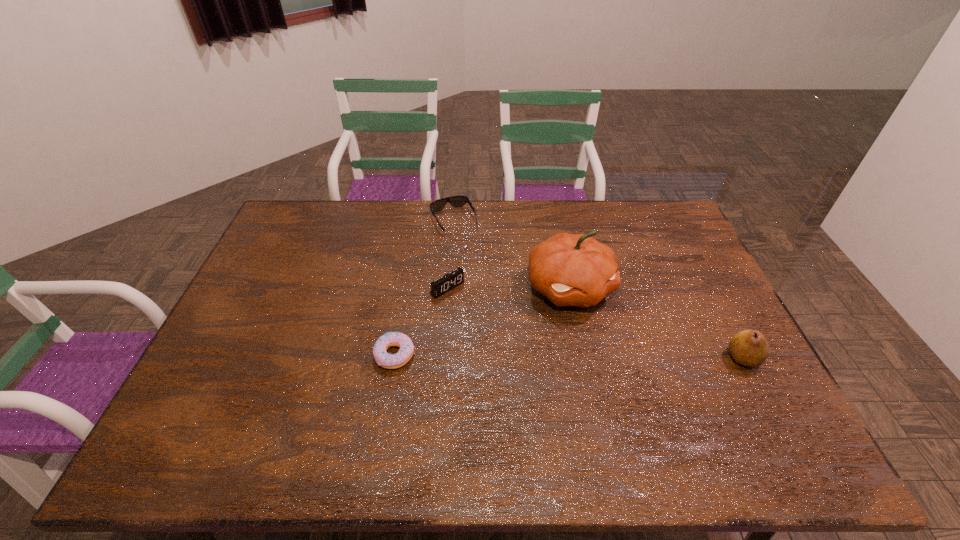
At what (x,y) coordinates should I click in order to perform the action: click on free space on the desktop that is between the doughnut and the rightmost object and is positioned on the front-facing side of the sunglasses. Please return your answer as a coordinate pair (x, y). Looking at the image, I should click on pos(527,356).

The height and width of the screenshot is (540, 960). I want to click on vacant space on the desktop that is between the doughnut and the second tallest object and is positioned on the front-facing side of the alarm clock, so click(x=521, y=356).

Where is `vacant space on the desktop that is between the doughnut and the pear and is positioned on the front face of the tallest object`? The width and height of the screenshot is (960, 540). vacant space on the desktop that is between the doughnut and the pear and is positioned on the front face of the tallest object is located at coordinates click(x=615, y=356).